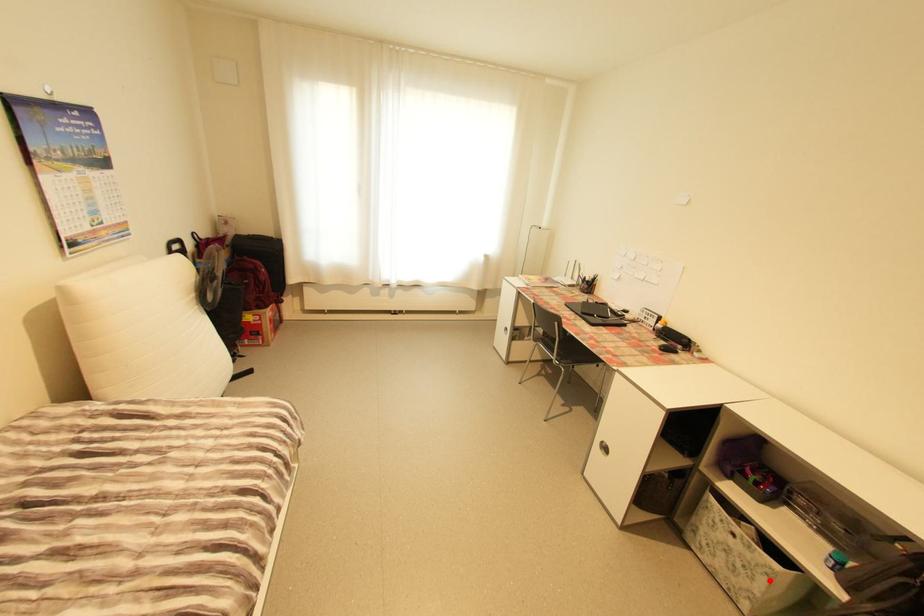
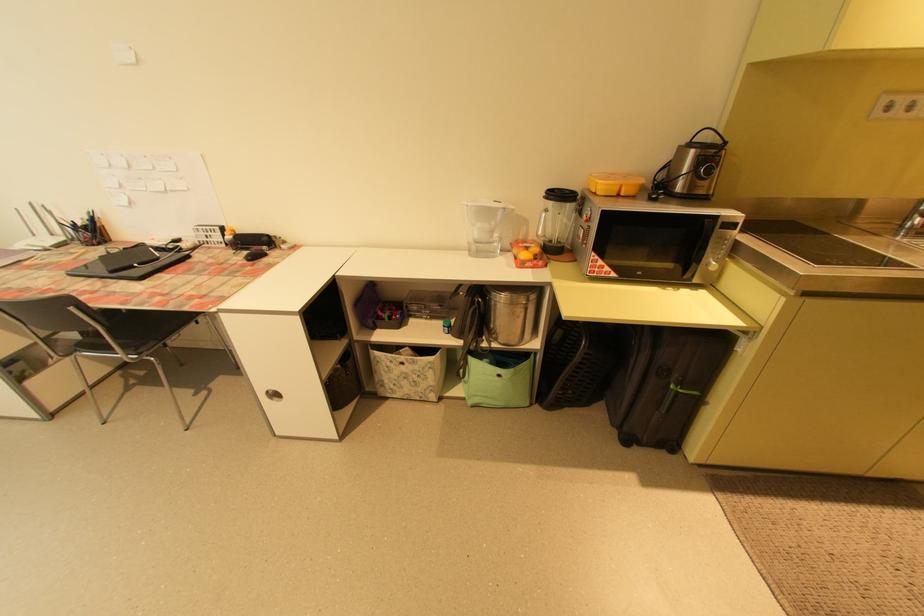
The point at the highlighted location is marked in the first image. Where is the corresponding point in the second image?

(436, 374)